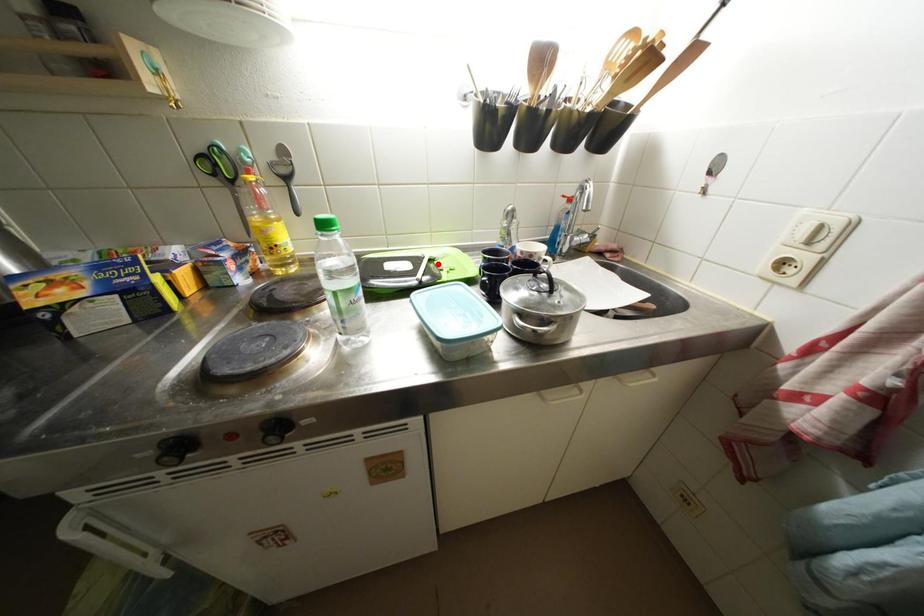
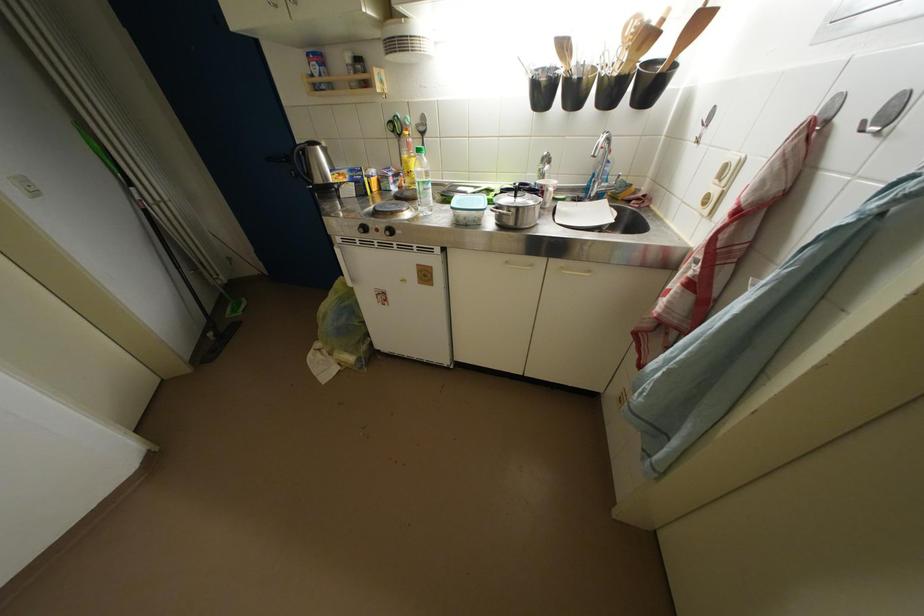
Find the pixel in the second image that matches the highlighted location in the first image.

(495, 193)